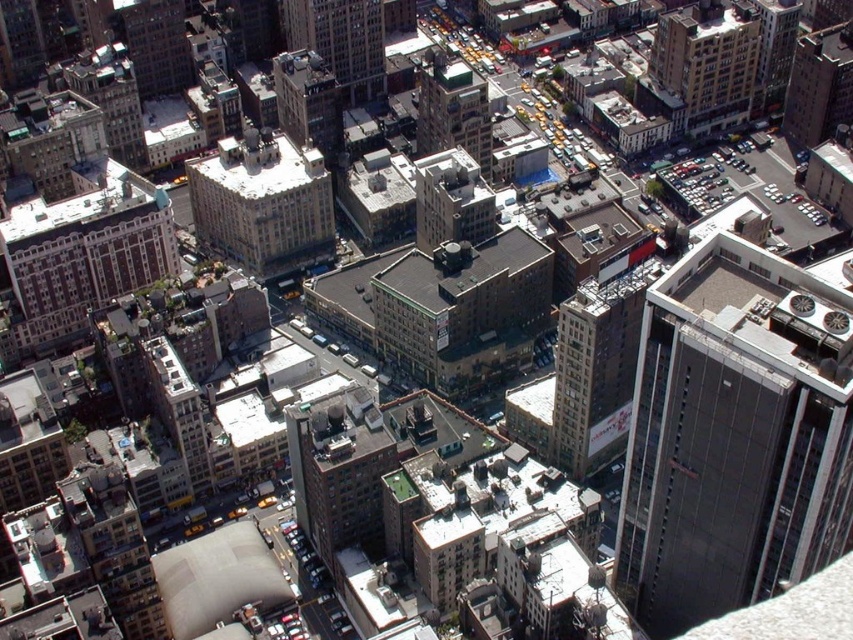
Question: Which of the following is the farthest from the observer?

Choices:
 (A) (704, 60)
 (B) (451, 225)
 (C) (589, 284)

Answer: (A)

Question: Is white stone building at left wider than gray concrete building at center?

Choices:
 (A) yes
 (B) no

Answer: (A)

Question: Is dark gray glass building at center right smaller than dark gray concrete building at upper right?

Choices:
 (A) yes
 (B) no

Answer: (B)

Question: Which point is closer to the camera?

Choices:
 (A) dark gray glass building at center right
 (B) gray concrete building at center

Answer: (A)

Question: Estimate the real-world distances between objects in this image. Which object is closer to the dark gray glass building at center right?

Choices:
 (A) green glass building at center
 (B) gray concrete building at center
 (C) brown brick building at upper right
 (D) white stone building at left

Answer: (B)

Question: Is dark gray glass building at center right closer to camera compared to white stone building at center?

Choices:
 (A) no
 (B) yes

Answer: (B)